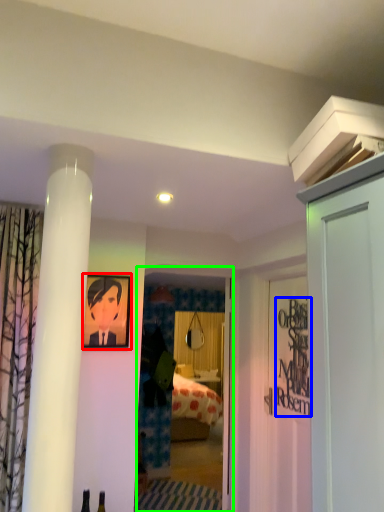
Question: Based on their relative distances, which object is farther from picture frame (highlighted by a red box)? Choose from writing (highlighted by a blue box) and glass door (highlighted by a green box).

Choices:
 (A) writing
 (B) glass door

Answer: (B)